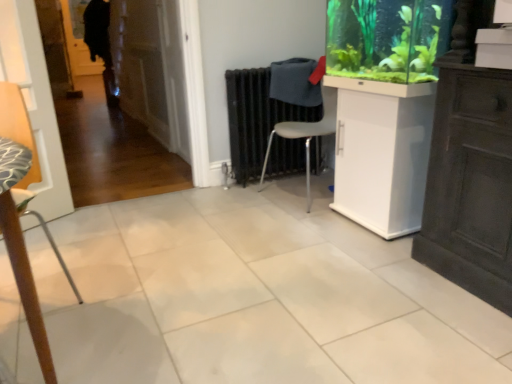
Question: Can you confirm if gray plastic chair at center, marked as the first chair in a back-to-front arrangement, is smaller than white glossy cabinet at center right?

Choices:
 (A) yes
 (B) no

Answer: (B)

Question: Is gray plastic chair at center, which is counted as the 1th chair, starting from the right, taller than white glossy cabinet at center right?

Choices:
 (A) no
 (B) yes

Answer: (B)

Question: Is gray plastic chair at center, arranged as the second chair when viewed from the left, located outside white glossy cabinet at center right?

Choices:
 (A) no
 (B) yes

Answer: (B)

Question: From a real-world perspective, is gray plastic chair at center, which is counted as the 1th chair, starting from the right, under white glossy cabinet at center right?

Choices:
 (A) no
 (B) yes

Answer: (A)

Question: From the image's perspective, is gray plastic chair at center, which ranks as the second chair in front-to-back order, located above white glossy cabinet at center right?

Choices:
 (A) yes
 (B) no

Answer: (A)

Question: Considering the relative positions of gray plastic chair at center, which ranks as the second chair in front-to-back order, and white glossy cabinet at center right in the image provided, is gray plastic chair at center, which ranks as the second chair in front-to-back order, behind white glossy cabinet at center right?

Choices:
 (A) no
 (B) yes

Answer: (B)

Question: From a real-world perspective, is gray plastic chair at center, which ranks as the second chair in front-to-back order, over wooden textured chair at left, the second chair positioned from the right?

Choices:
 (A) yes
 (B) no

Answer: (B)

Question: Can you confirm if gray plastic chair at center, which ranks as the second chair in front-to-back order, is wider than wooden textured chair at left, the second chair positioned from the right?

Choices:
 (A) no
 (B) yes

Answer: (B)

Question: Is gray plastic chair at center, which is counted as the 1th chair, starting from the right, directly adjacent to wooden textured chair at left, which ranks as the 1th chair in left-to-right order?

Choices:
 (A) no
 (B) yes

Answer: (A)

Question: Considering the relative sizes of gray plastic chair at center, which is counted as the 1th chair, starting from the right, and wooden textured chair at left, which is counted as the first chair, starting from the front, in the image provided, is gray plastic chair at center, which is counted as the 1th chair, starting from the right, shorter than wooden textured chair at left, which is counted as the first chair, starting from the front,?

Choices:
 (A) no
 (B) yes

Answer: (B)

Question: Is gray plastic chair at center, which is counted as the 1th chair, starting from the right, positioned in front of wooden textured chair at left, the second chair positioned from the right?

Choices:
 (A) no
 (B) yes

Answer: (A)

Question: Is gray plastic chair at center, arranged as the second chair when viewed from the left, turned away from wooden textured chair at left, arranged as the second chair when viewed from the back?

Choices:
 (A) no
 (B) yes

Answer: (A)

Question: Is white glossy cabinet at center right taller than gray plastic chair at center, marked as the first chair in a back-to-front arrangement?

Choices:
 (A) no
 (B) yes

Answer: (A)